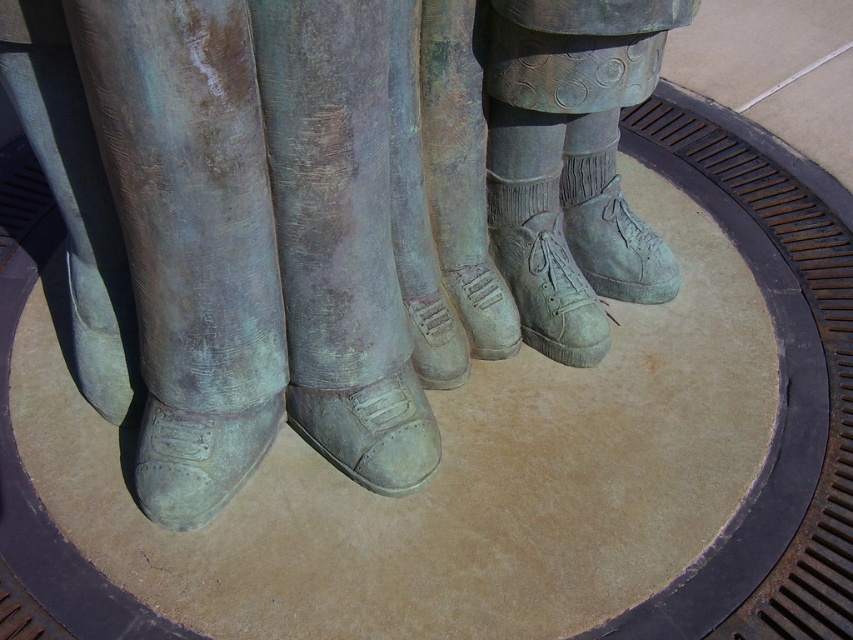
In the scene shown: You are an art conservator assessing the statues. You need to determine which object is taller between the bronze shoes at center and the matte green boot at center. Which one is taller?

The bronze shoes at center has a greater height compared to the matte green boot at center, so the bronze shoes at center is taller.

You are an art conservator examining the two statues. You need to place a protective cover over the bronze shoes at center and the green suede boot at center. Since the covers are rectangular and can only be placed horizontally, which object should you cover first to ensure the covers don not overlap?

The bronze shoes at center should be covered first since it is to the left of the green suede boot at center, allowing the rectangular cover to be placed without overlapping when moving from left to right.

You are standing in front of the statues and want to take a photo of the green patina boot at center. To ensure the boot is centered in your photo, where should you aim your camera? Provide the coordinates as a point in the format like point X, Y.

The green patina boot at center is located at point [370,429], so aim your camera at that point to center it in the photo.